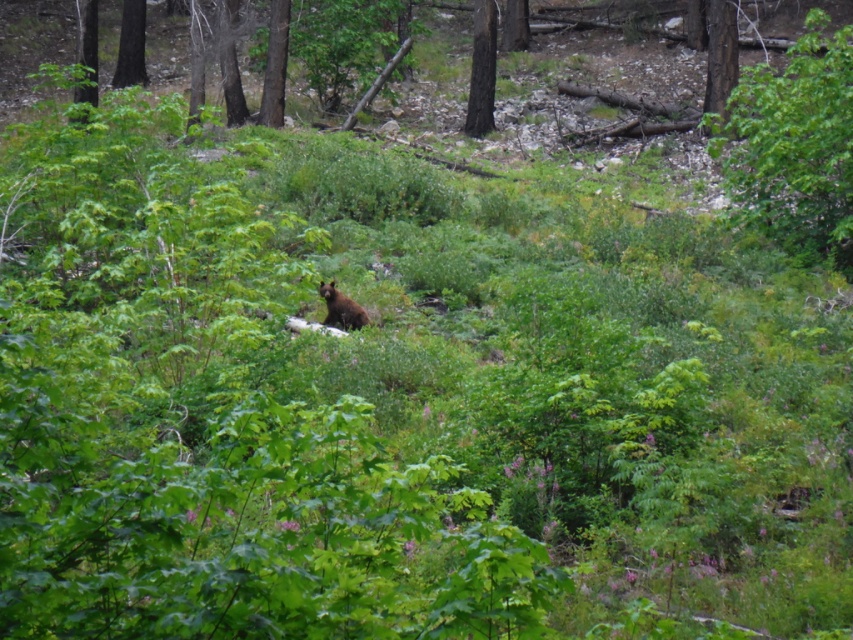
The image size is (853, 640). What do you see at coordinates (795, 147) in the screenshot?
I see `green leafy tree at upper right` at bounding box center [795, 147].

Is green leafy tree at upper right smaller than brown wood tree at upper center?

No.

Looking at this image, who is more distant from viewer, (785, 132) or (259, 109)?

The point (259, 109) is more distant.

In order to click on green leafy tree at upper right in this screenshot , I will do `click(795, 147)`.

Does green leafy tree at upper right come in front of smooth brown tree trunk at upper left?

That is True.

Who is more forward, (x=825, y=109) or (x=132, y=61)?

Positioned in front is point (x=825, y=109).

You are a GUI agent. You are given a task and a screenshot of the screen. Output one action in this format:
    pyautogui.click(x=<x>, y=<y>)
    Task: Click on the green leafy tree at upper right
    
    Given the screenshot: What is the action you would take?
    pyautogui.click(x=795, y=147)

Is smooth bark tree at upper left bigger than brown furry bear at center?

Yes.

Is smooth bark tree at upper left above brown furry bear at center?

Indeed, smooth bark tree at upper left is positioned over brown furry bear at center.

Between point (93, 3) and point (326, 314), which one is positioned in front?

Point (326, 314)

At what (x,y) coordinates should I click in order to perform the action: click on smooth bark tree at upper left. Please return your answer as a coordinate pair (x, y). The height and width of the screenshot is (640, 853). Looking at the image, I should click on (86, 49).